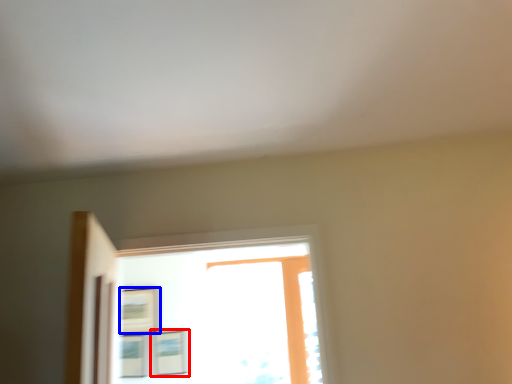
Question: Which object is closer to the camera taking this photo, picture frame (highlighted by a red box) or picture frame (highlighted by a blue box)?

Choices:
 (A) picture frame
 (B) picture frame

Answer: (A)